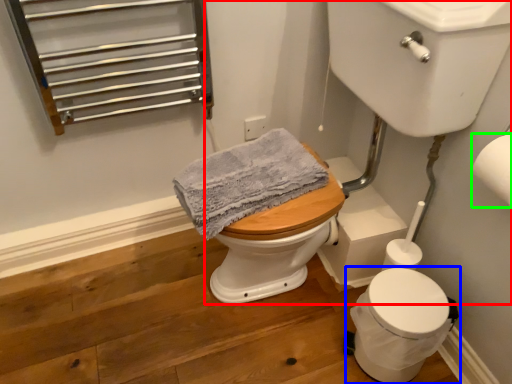
Question: Which is nearer to the sink (highlighted by a red box)? toilet (highlighted by a blue box) or toilet paper (highlighted by a green box).

Choices:
 (A) toilet
 (B) toilet paper

Answer: (B)